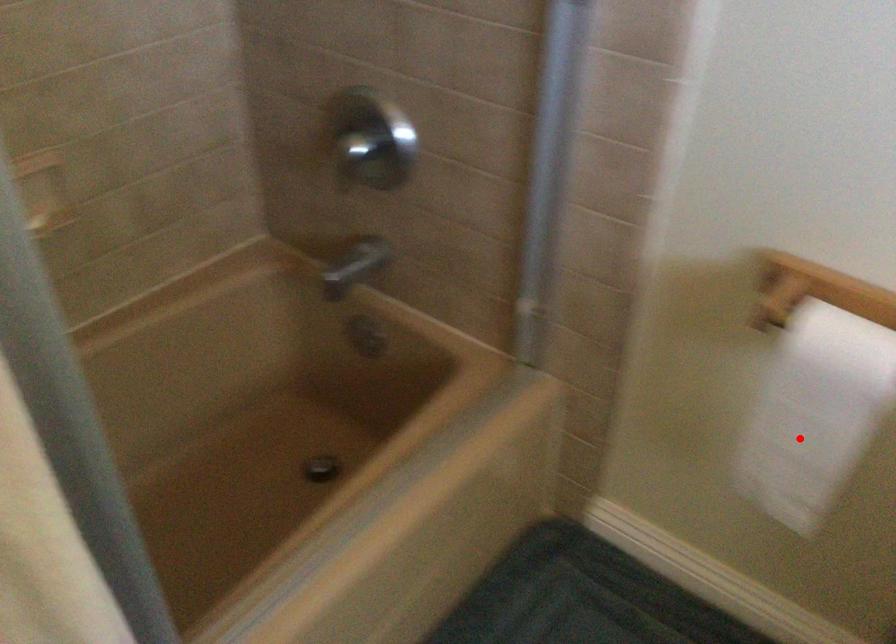
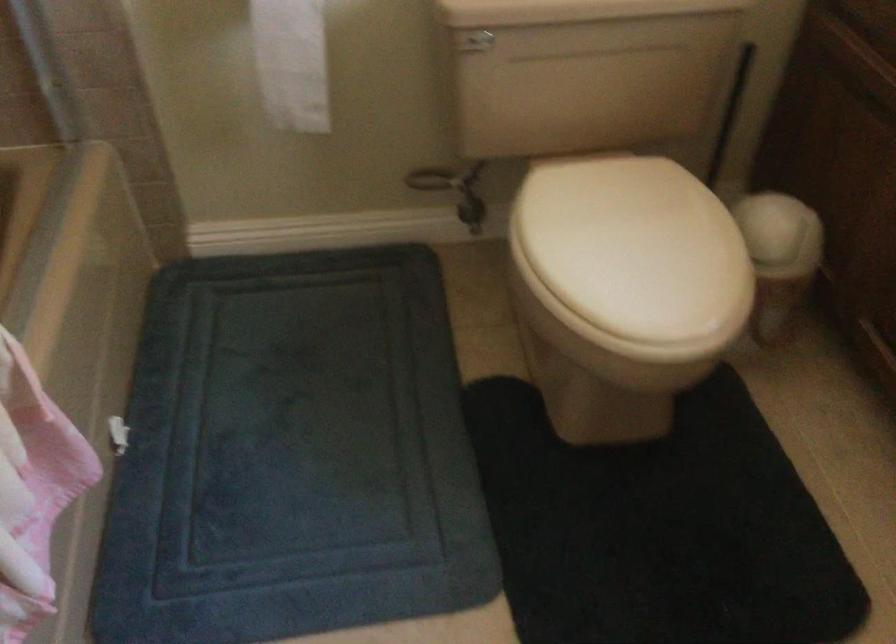
The point at the highlighted location is marked in the first image. Where is the corresponding point in the second image?

(291, 62)